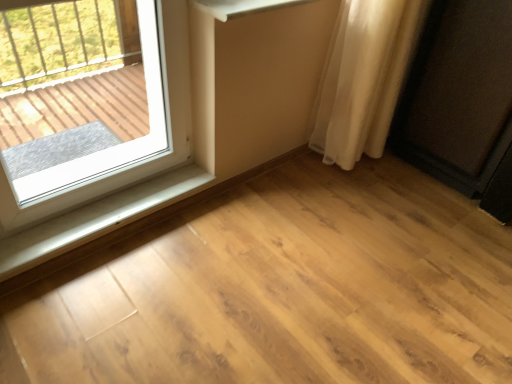
Locate an element on the screen. This screenshot has height=384, width=512. free space above white plastic window sill at lower left (from a real-world perspective) is located at coordinates (105, 213).